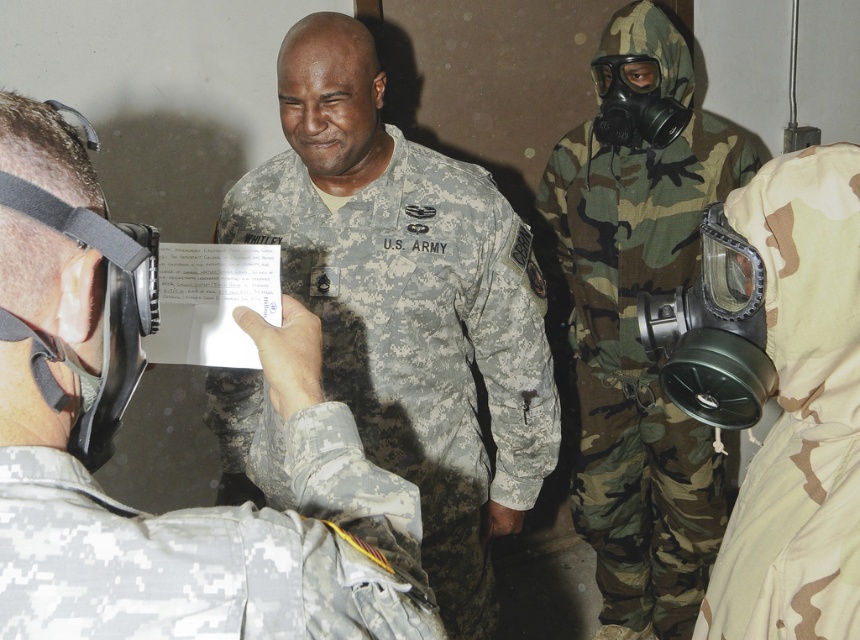
Which is in front, point (373, 579) or point (817, 214)?

Point (373, 579) is in front.

Is point (286, 458) less distant than point (751, 616)?

That is True.

Identify the location of camouflage uniform at center. (203, 528).

Who is more distant from viewer, (624, 433) or (796, 275)?

Positioned behind is point (624, 433).

Between camo fabric gas mask at right and camouflage fabric gas mask at right, which one has more height?

camo fabric gas mask at right

Find the location of a particular element. The image size is (860, 640). camo fabric gas mask at right is located at coordinates (636, 328).

The image size is (860, 640). I want to click on camo fabric gas mask at right, so click(x=636, y=328).

Does camouflage uniform at center have a greater height compared to camouflage fabric us army uniform at center?

In fact, camouflage uniform at center may be shorter than camouflage fabric us army uniform at center.

Does camouflage uniform at center have a lesser height compared to camouflage fabric us army uniform at center?

Yes.

Measure the distance between point (x=354, y=461) and camera.

Point (x=354, y=461) and camera are 33.68 inches apart.

I want to click on camouflage uniform at center, so click(x=203, y=528).